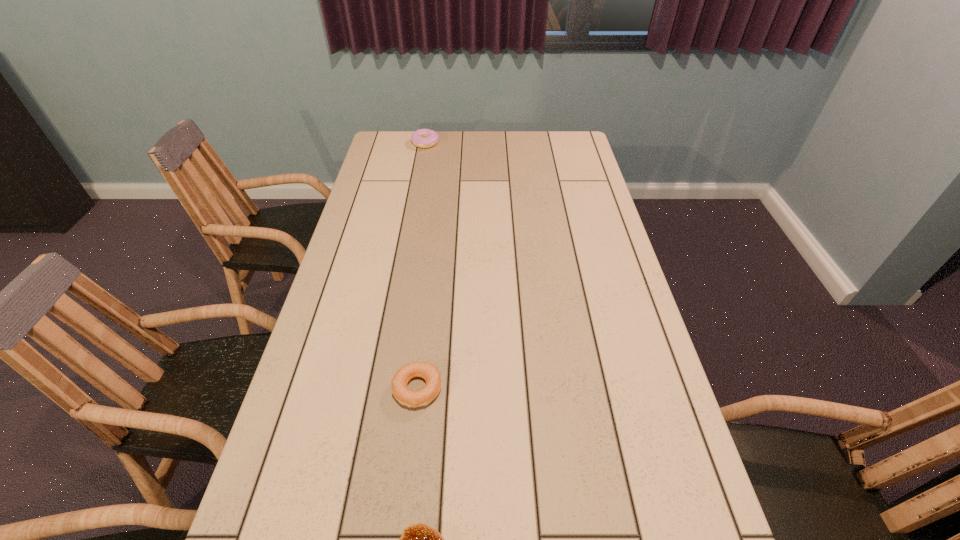
In the image, there is a desktop. Identify the location of vacant space at the far left corner. (405, 134).

In the image, there is a desktop. At what (x,y) coordinates should I click in order to perform the action: click on vacant space at the far right corner. Please return your answer as a coordinate pair (x, y). Looking at the image, I should click on (568, 139).

Where is `free space between the farthest object and the farther bagel`? free space between the farthest object and the farther bagel is located at coordinates (421, 266).

Find the location of a particular element. free spot between the doughnut and the farther bagel is located at coordinates (421, 266).

Identify the location of empty location between the doughnut and the farther bagel. This screenshot has width=960, height=540. (421, 266).

Select which object appears as the second closest to the nearer bagel. Please provide its 2D coordinates. Your answer should be formatted as a tuple, i.e. [(x, y)], where the tuple contains the x and y coordinates of a point satisfying the conditions above.

[(423, 138)]

Identify which object is the nearest to the nearest object. Please provide its 2D coordinates. Your answer should be formatted as a tuple, i.e. [(x, y)], where the tuple contains the x and y coordinates of a point satisfying the conditions above.

[(422, 397)]